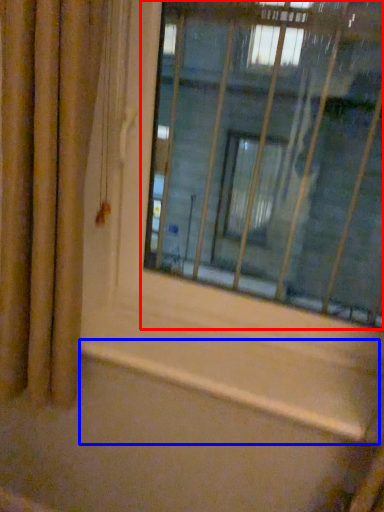
Question: Which point is further to the camera, window (highlighted by a red box) or window sill (highlighted by a blue box)?

Choices:
 (A) window
 (B) window sill

Answer: (B)